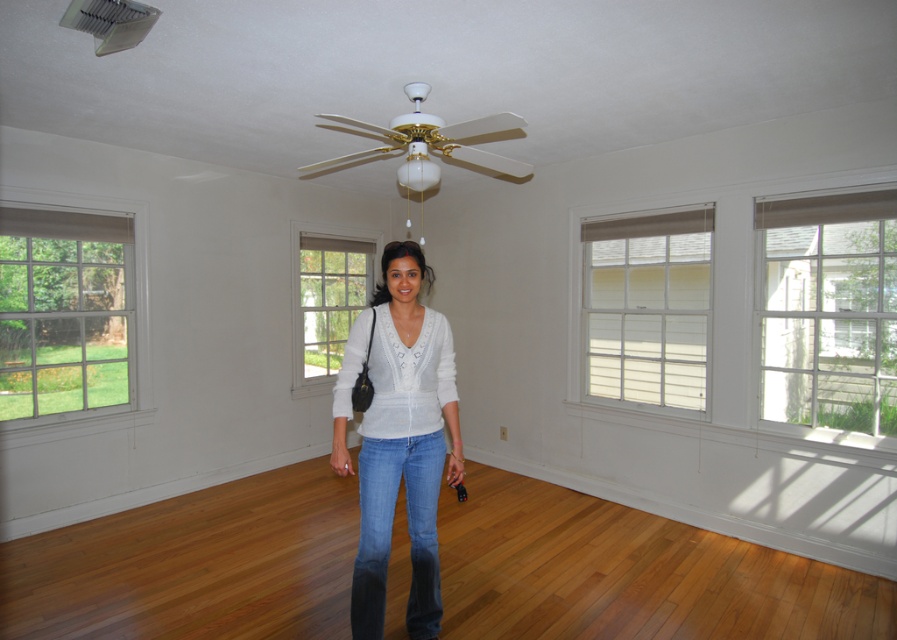
You are an interior designer assessing the room layout. You notice the white knit sweater at center and the white glossy ceiling fan at upper center. Which object would appear larger in the room?

The white glossy ceiling fan at upper center appears larger than the white knit sweater at center.

You are a painter who needs to hang a 1.5 meter tall painting on the wall. You see the denim at center and the white glossy ceiling fan at upper center in the room. Which object should you avoid placing the painting near to ensure it doesn

The denim at center is much taller than the white glossy ceiling fan at upper center. Therefore, you should avoid placing the painting near the denim at center to ensure proper clearance.